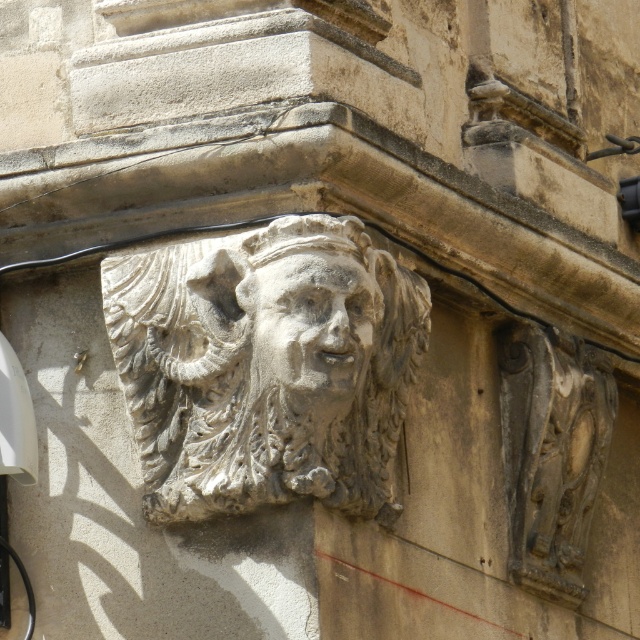
You are standing in front of a building and see the carved stone mask at upper right. If you want to touch it, would you need to climb a ladder or can you reach it while standing on the ground?

The carved stone mask at upper right is 155.04 feet away from the viewer, so you would need to climb a ladder to reach it.

You are standing in front of an architectural detail of a carved stone face on a building. There is a point at coordinates point (x=378, y=333). If you want to place a small decorative plaque exactly 40 meters away from where you are standing, will the plaque be closer to or farther from the point compared to your current position?

The distance between point (x=378, y=333) and the viewer is 43.02 meters. If you place the plaque 40 meters away from your current position, it will be closer to the point than your current position since 40 meters is less than 43.02 meters.

You are an architect examining the building details. You need to determine the spatial relationship between the gray stone face at center and the carved stone mask at upper right. Which one is positioned higher in the image?

The gray stone face at center is positioned higher than the carved stone mask at upper right according to the description.